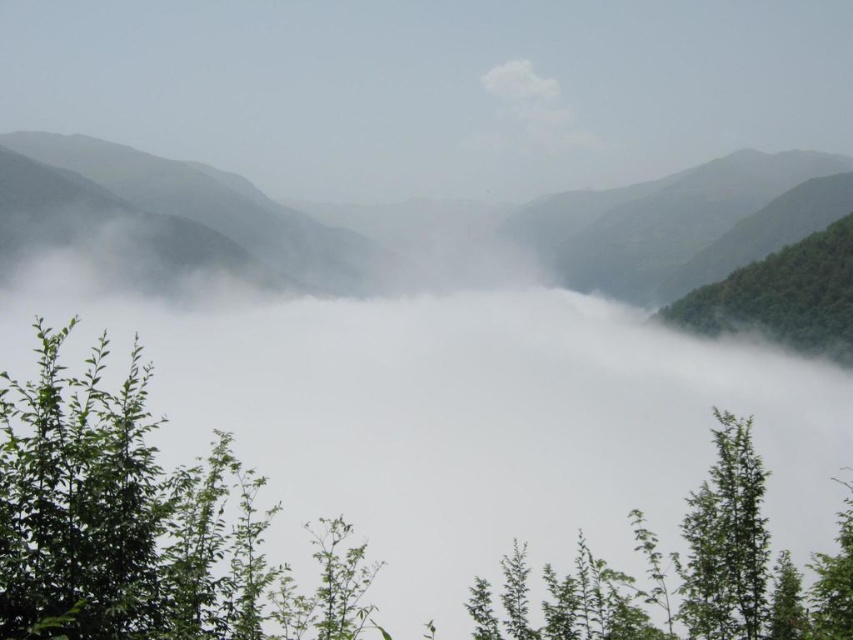
Question: Which point is farther to the camera?

Choices:
 (A) white fluffy cloud at upper center
 (B) green leafy tree at lower left
 (C) green leafy tree at center
 (D) green leafy tree at lower right

Answer: (A)

Question: Where is green leafy tree at lower left located in relation to green leafy tree at right in the image?

Choices:
 (A) above
 (B) below

Answer: (B)

Question: Does green leafy tree at center appear on the left side of green leafy tree at right?

Choices:
 (A) no
 (B) yes

Answer: (B)

Question: Which of the following is the farthest from the observer?

Choices:
 (A) green matte mountain at center
 (B) green leafy tree at lower left
 (C) green leafy tree at right
 (D) green leafy tree at lower right

Answer: (A)

Question: Which object is farther from the camera taking this photo?

Choices:
 (A) green matte mountain at center
 (B) green leafy tree at right
 (C) green leafy tree at center

Answer: (A)

Question: Is green matte mountain at center below green leafy tree at lower right?

Choices:
 (A) yes
 (B) no

Answer: (B)